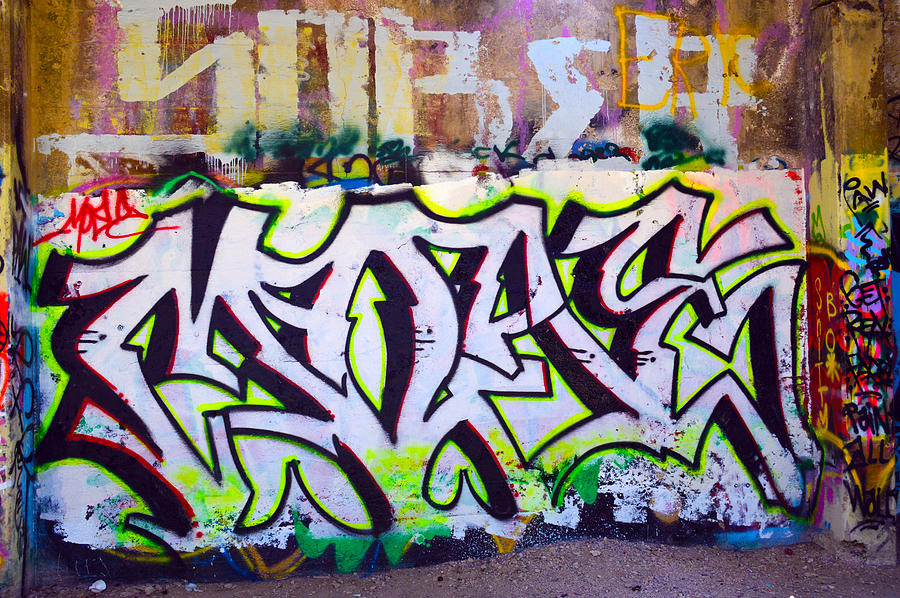
Where is `light green paint`? light green paint is located at coordinates (618, 204).